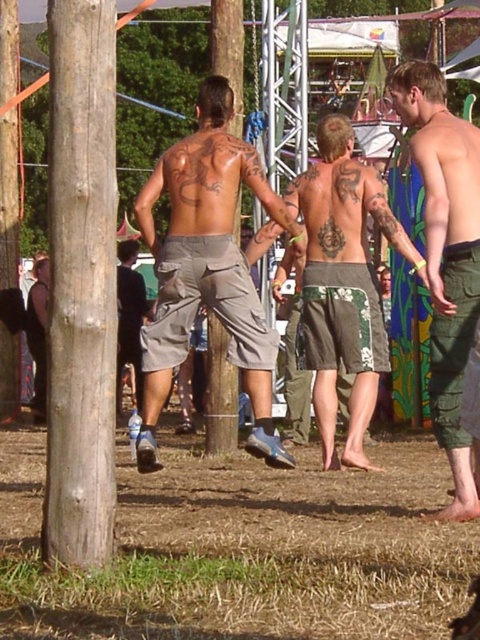
You are a photographer trying to capture a photo of the light brown wood pole at left and the green camouflage pants at right. Which object should you focus on first if you want to ensure both are in the frame without moving the camera?

You should focus on the light brown wood pole at left first because it is positioned on the left side of the green camouflage pants at right, so keeping the pole in the frame ensures the pants will also be included as they are to the right of it.